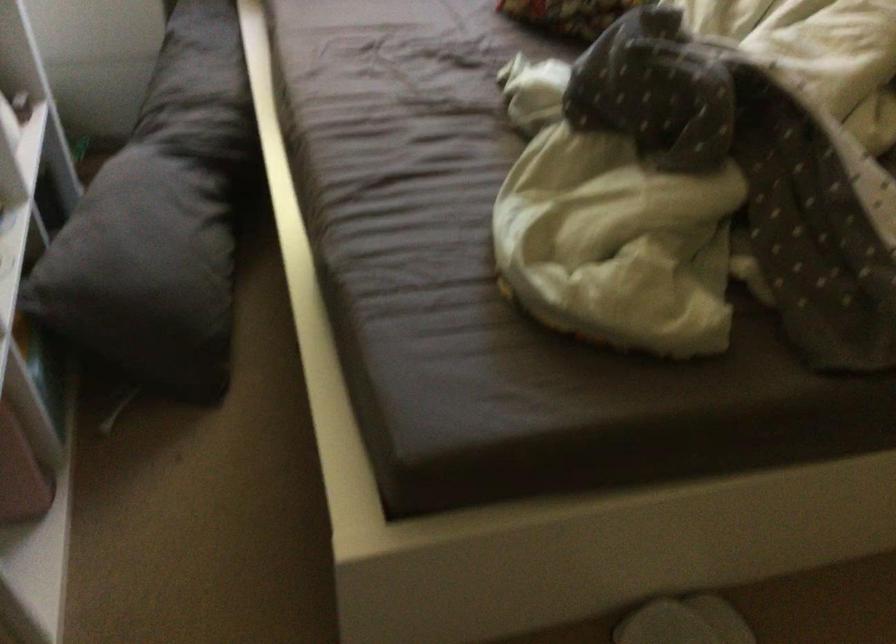
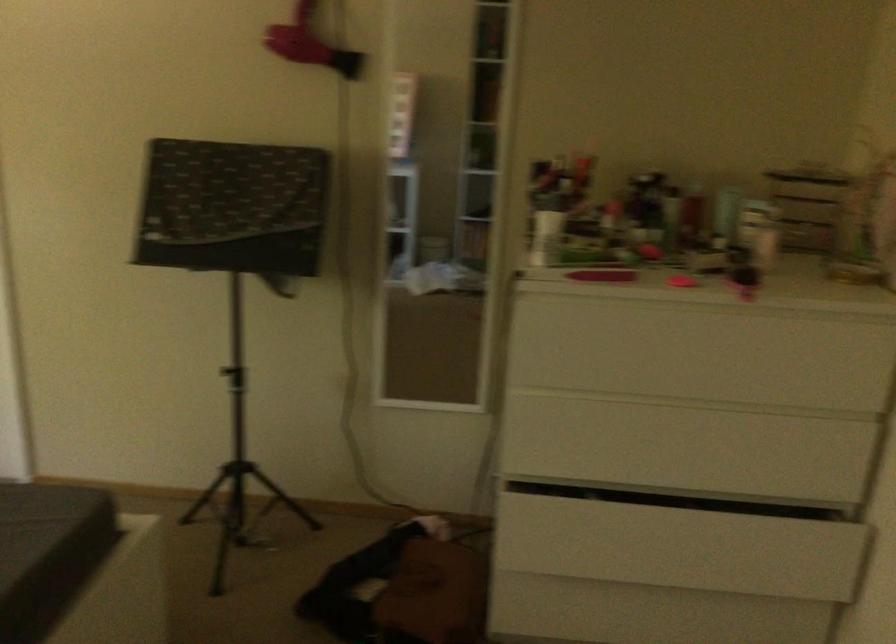
Question: The first image is from the beginning of the video and the second image is from the end. How did the camera likely rotate when shooting the video?

Choices:
 (A) Left
 (B) Right
 (C) Up
 (D) Down

Answer: (B)